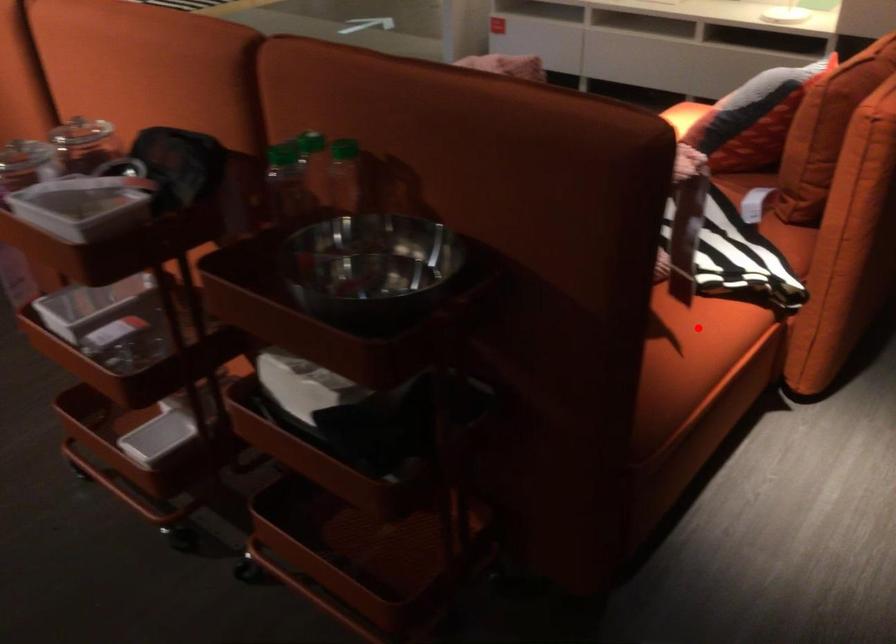
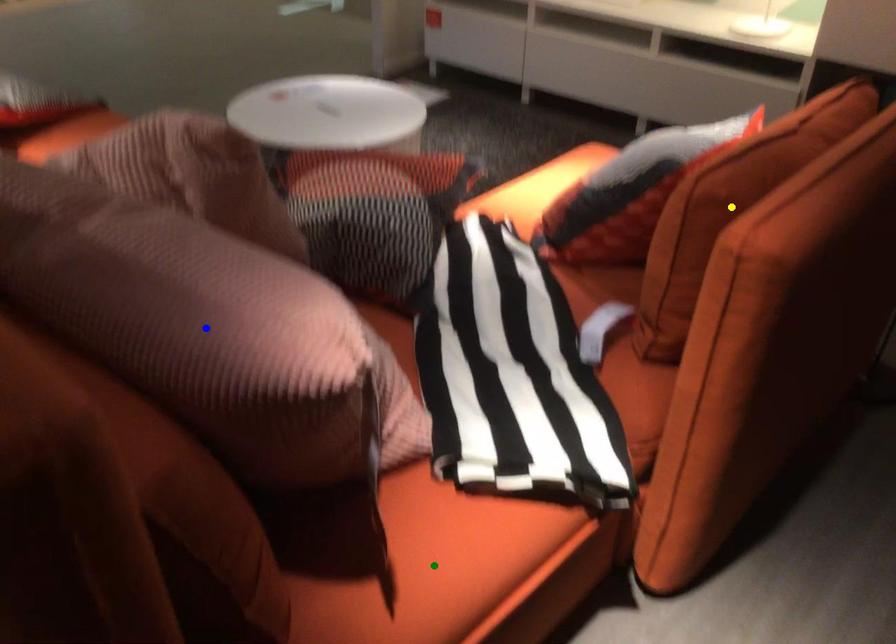
Question: I am providing you with two images of the same scene from different viewpoints. A red point is marked on the first image. You are given multiple points on the second image. Which point in image 2 is actually the same real-world point as the red point in image 1?

Choices:
 (A) green point
 (B) yellow point
 (C) blue point

Answer: (A)